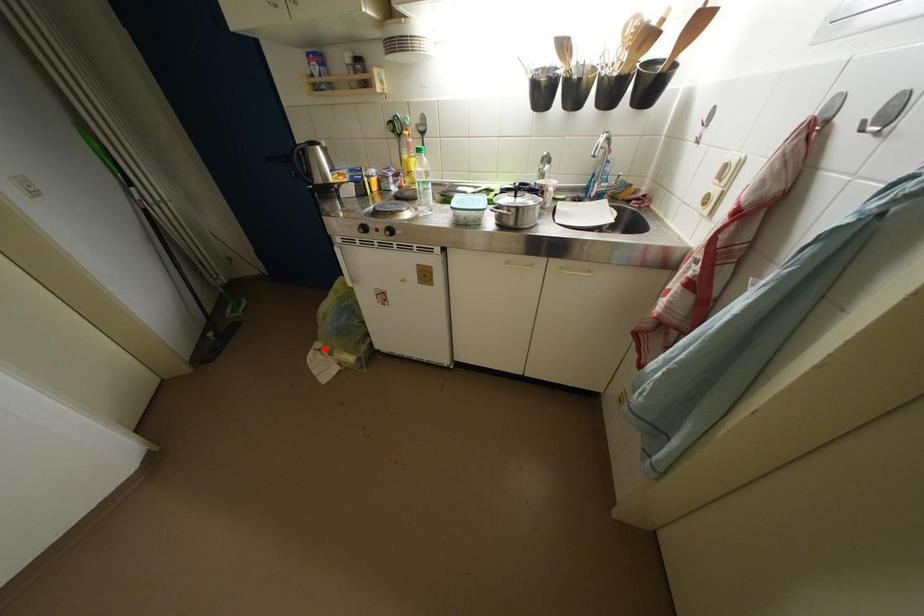
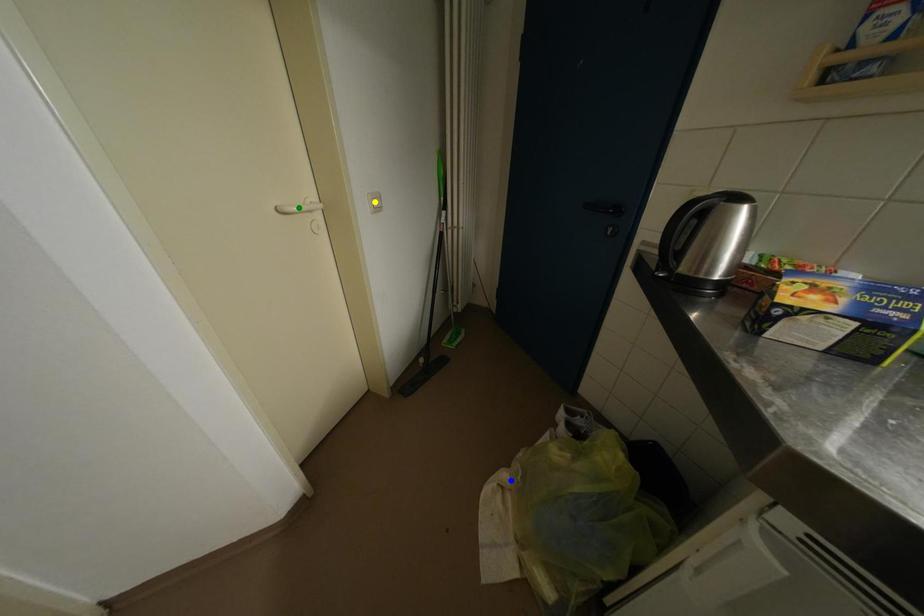
Question: I am providing you with two images of the same scene from different viewpoints. A red point is marked on the first image. You are given multiple points on the second image. In image 2, which mark is for the same physical point as the one in image 1?

Choices:
 (A) green point
 (B) blue point
 (C) yellow point

Answer: (B)